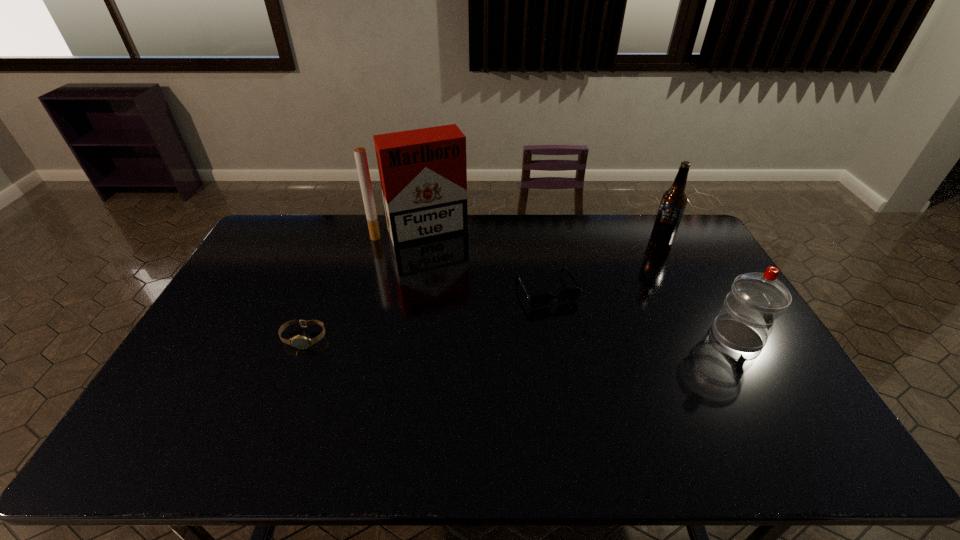
The width and height of the screenshot is (960, 540). In order to click on vacant point located between the beer bottle and the third farthest object in this screenshot , I will do `click(604, 265)`.

Locate an element on the screen. This screenshot has width=960, height=540. empty space between the third tallest object and the tallest object is located at coordinates (579, 284).

Locate an element on the screen. free space between the tallest object and the leftmost object is located at coordinates (362, 285).

This screenshot has height=540, width=960. I want to click on vacant region between the beer bottle and the fourth object from right to left, so click(x=540, y=236).

The width and height of the screenshot is (960, 540). I want to click on free space between the third shortest object and the second object from left to right, so click(x=579, y=284).

At what (x,y) coordinates should I click in order to perform the action: click on empty space that is in between the cigarette case and the sunglasses. Please return your answer as a coordinate pair (x, y). Looking at the image, I should click on (484, 260).

The image size is (960, 540). Identify the location of free space between the third object from right to left and the watch. (425, 314).

I want to click on empty location between the fourth object from right to left and the fourth shortest object, so click(x=540, y=236).

Identify which object is the third nearest to the tallest object. Please provide its 2D coordinates. Your answer should be formatted as a tuple, i.e. [(x, y)], where the tuple contains the x and y coordinates of a point satisfying the conditions above.

[(673, 202)]

Select which object appears as the third closest to the third tallest object. Please provide its 2D coordinates. Your answer should be formatted as a tuple, i.e. [(x, y)], where the tuple contains the x and y coordinates of a point satisfying the conditions above.

[(423, 173)]